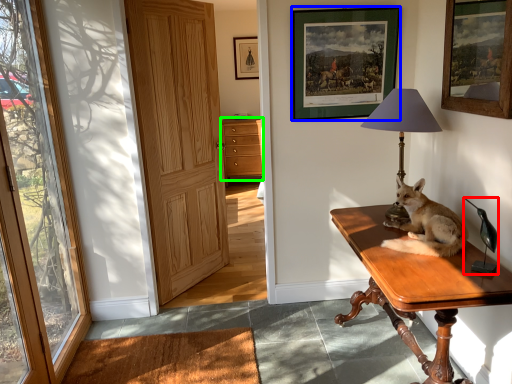
Question: Considering the real-world distances, which object is farthest from corded phone (highlighted by a red box)? picture frame (highlighted by a blue box) or cabinetry (highlighted by a green box)?

Choices:
 (A) picture frame
 (B) cabinetry

Answer: (B)